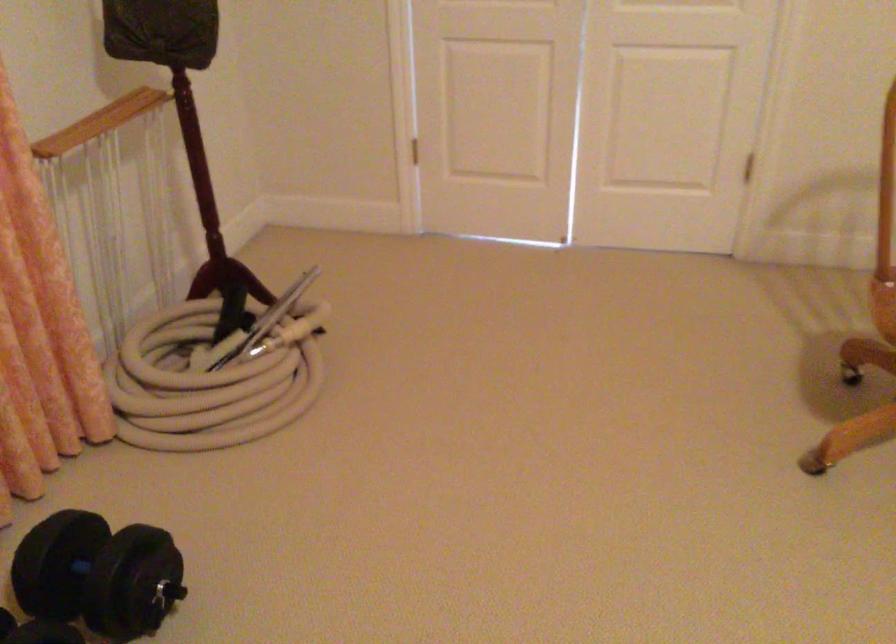
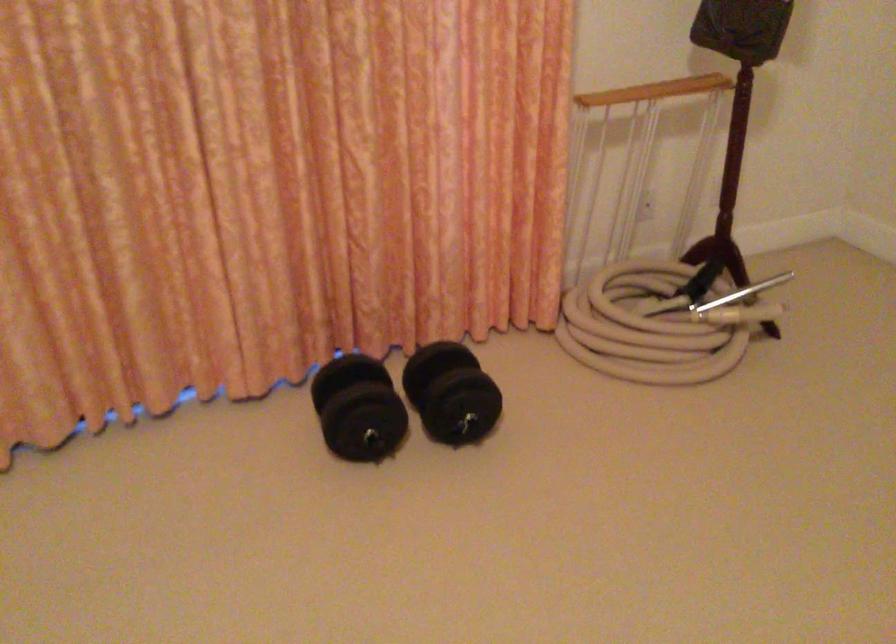
Find the pixel in the second image that matches [168,105] in the first image.

(711, 78)